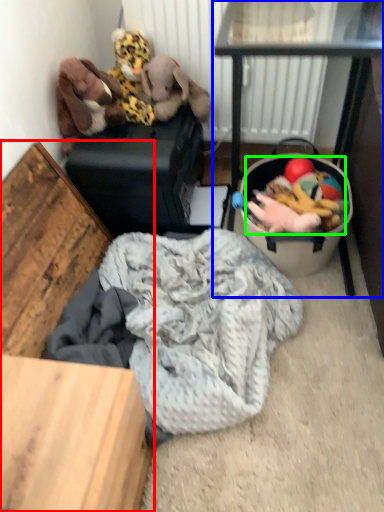
Question: Which is farther away from furniture (highlighted by a red box)? table (highlighted by a blue box) or stuff (highlighted by a green box)?

Choices:
 (A) table
 (B) stuff

Answer: (A)